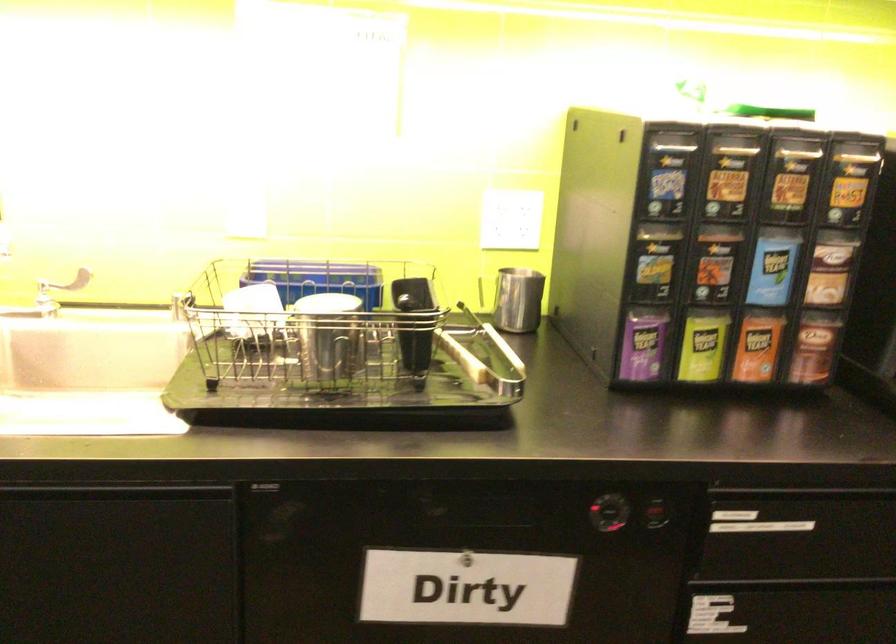
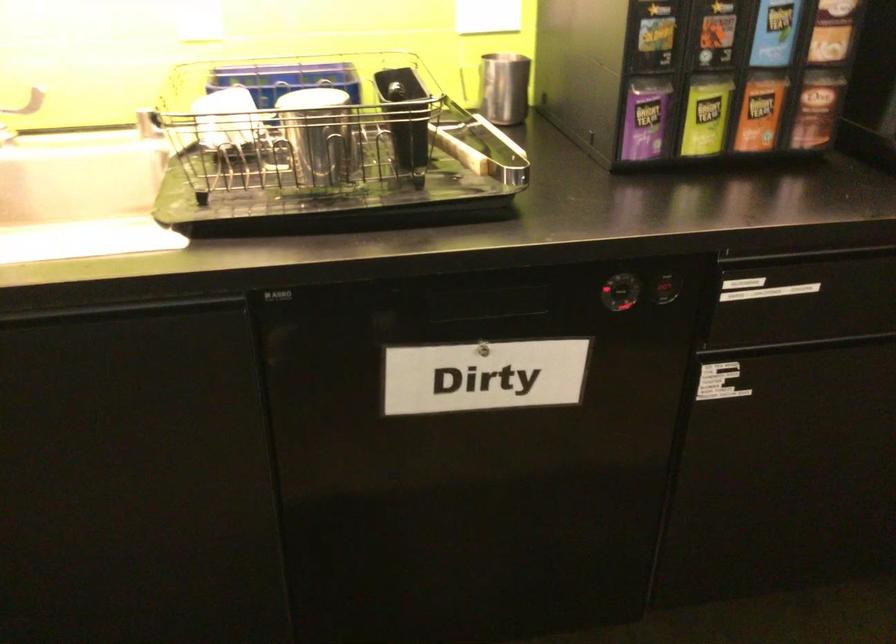
Where in the second image is the point corresponding to the point at 798,494 from the first image?

(807, 254)